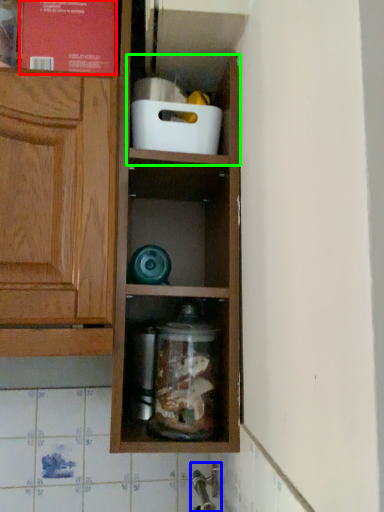
Question: Which object is positioned closest to book (highlighted by a red box)? Select from faucet (highlighted by a blue box) and cabinet (highlighted by a green box).

Choices:
 (A) faucet
 (B) cabinet

Answer: (B)